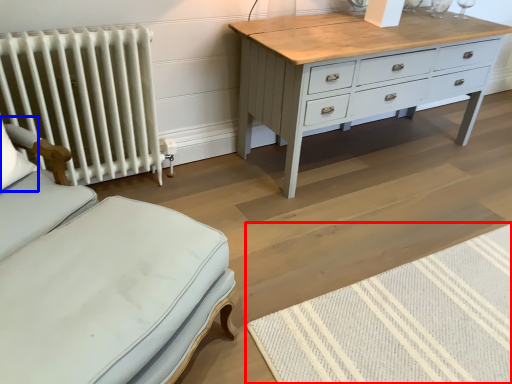
Question: Which object appears closest to the camera in this image, mat (highlighted by a red box) or pillow (highlighted by a blue box)?

Choices:
 (A) mat
 (B) pillow

Answer: (A)